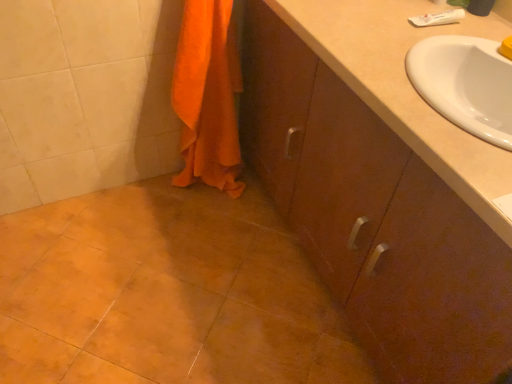
Where is `vacant area on top of matte brown cabinet at center (from a real-world perspective)`? The width and height of the screenshot is (512, 384). vacant area on top of matte brown cabinet at center (from a real-world perspective) is located at coordinates pos(411,38).